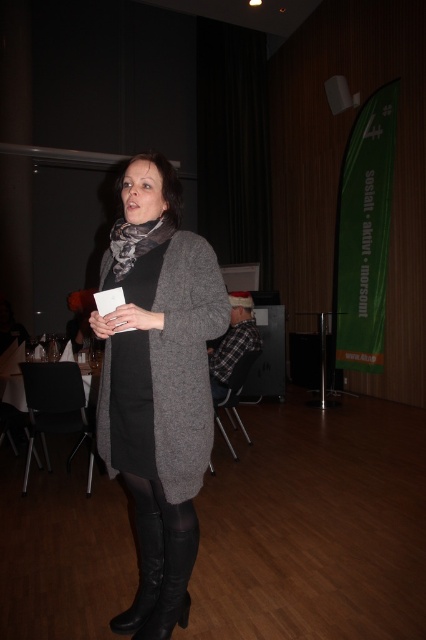
Which of these two, black matte dress at center or black leather boot at lower center, stands taller?

Standing taller between the two is black matte dress at center.

Can you confirm if black matte dress at center is positioned to the left of black leather boot at lower center?

Indeed, black matte dress at center is positioned on the left side of black leather boot at lower center.

Is point (120, 362) more distant than point (169, 609)?

No.

Locate an element on the screen. black matte dress at center is located at coordinates (131, 404).

Between matte gray cardigan at center and black matte dress at center, which one has less height?

black matte dress at center is shorter.

Does matte gray cardigan at center have a lesser height compared to black matte dress at center?

No, matte gray cardigan at center is not shorter than black matte dress at center.

In order to click on matte gray cardigan at center in this screenshot , I will do `click(158, 385)`.

Which of these two, black leather boot at lower center or patterned fabric scarf at center, stands taller?

Standing taller between the two is black leather boot at lower center.

How much distance is there between black leather boot at lower center and patterned fabric scarf at center?

black leather boot at lower center and patterned fabric scarf at center are 39.14 inches apart.

Which is in front, point (192, 561) or point (127, 256)?

Point (127, 256) is in front.

Identify the location of black leather boot at lower center. This screenshot has height=640, width=426. (172, 584).